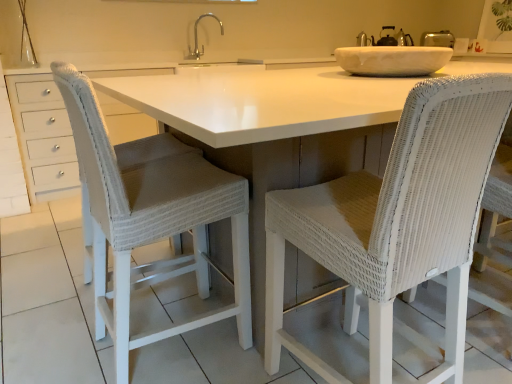
Question: Are white wicker chair at center, placed as the 2th chair when sorted from left to right, and silver metallic faucet at upper center making contact?

Choices:
 (A) yes
 (B) no

Answer: (B)

Question: Is white wicker chair at center, placed as the 2th chair when sorted from left to right, thinner than silver metallic faucet at upper center?

Choices:
 (A) yes
 (B) no

Answer: (B)

Question: Can you confirm if white wicker chair at center, placed as the 2th chair when sorted from left to right, is bigger than silver metallic faucet at upper center?

Choices:
 (A) no
 (B) yes

Answer: (B)

Question: Is there a large distance between white wicker chair at center, placed as the 2th chair when sorted from left to right, and silver metallic faucet at upper center?

Choices:
 (A) yes
 (B) no

Answer: (A)

Question: Can you confirm if white wicker chair at center, the first chair in the right-to-left sequence, is taller than silver metallic faucet at upper center?

Choices:
 (A) no
 (B) yes

Answer: (B)

Question: Is white wicker chair at center, placed as the 2th chair when sorted from left to right, outside of silver metallic faucet at upper center?

Choices:
 (A) no
 (B) yes

Answer: (B)

Question: Is white wicker chair at center, placed as the 1th chair when sorted from left to right, directly adjacent to silver metallic faucet at upper center?

Choices:
 (A) no
 (B) yes

Answer: (A)

Question: Does white wicker chair at center, placed as the 1th chair when sorted from left to right, have a lesser width compared to silver metallic faucet at upper center?

Choices:
 (A) yes
 (B) no

Answer: (B)

Question: From the image's perspective, is white wicker chair at center, placed as the 1th chair when sorted from left to right, under silver metallic faucet at upper center?

Choices:
 (A) yes
 (B) no

Answer: (A)

Question: Is white wicker chair at center, which is the 2th chair from right to left, in front of silver metallic faucet at upper center?

Choices:
 (A) no
 (B) yes

Answer: (B)

Question: Is there a large distance between white wicker chair at center, which is the 2th chair from right to left, and silver metallic faucet at upper center?

Choices:
 (A) no
 (B) yes

Answer: (B)

Question: Can you confirm if white wicker chair at center, which is the 2th chair from right to left, is wider than silver metallic faucet at upper center?

Choices:
 (A) no
 (B) yes

Answer: (B)

Question: Does white wicker chair at center, placed as the 2th chair when sorted from left to right, come behind white wicker chair at center, which is the 2th chair from right to left?

Choices:
 (A) no
 (B) yes

Answer: (A)